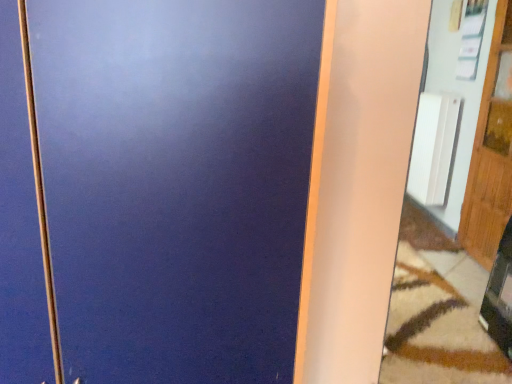
Question: Is white ribbed radiator at right in front of or behind matte white mirror at right in the image?

Choices:
 (A) front
 (B) behind

Answer: (B)

Question: Visually, is white ribbed radiator at right positioned to the left or to the right of matte white mirror at right?

Choices:
 (A) left
 (B) right

Answer: (B)

Question: Based on their relative distances, which object is nearer to the wooden door at right?

Choices:
 (A) white ribbed radiator at right
 (B) matte white mirror at right

Answer: (B)

Question: Estimate the real-world distances between objects in this image. Which object is closer to the wooden door at right?

Choices:
 (A) white ribbed radiator at right
 (B) matte white mirror at right

Answer: (B)